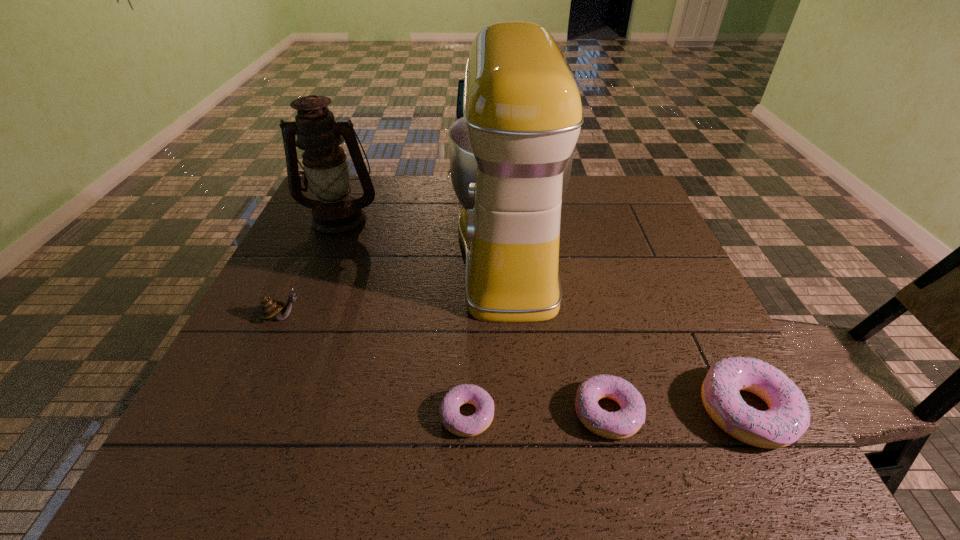
Where is `the leftmost doughnut`? This screenshot has width=960, height=540. the leftmost doughnut is located at coordinates (465, 426).

At what (x,y) coordinates should I click in order to perform the action: click on the shortest object. Please return your answer as a coordinate pair (x, y). Looking at the image, I should click on (465, 426).

Image resolution: width=960 pixels, height=540 pixels. Identify the location of the second shortest doughnut. (625, 422).

At what (x,y) coordinates should I click in order to perform the action: click on the second shortest object. Please return your answer as a coordinate pair (x, y). This screenshot has width=960, height=540. Looking at the image, I should click on (625, 422).

Where is `the fourth tallest object`? The height and width of the screenshot is (540, 960). the fourth tallest object is located at coordinates (788, 417).

In order to click on the rightmost object in this screenshot , I will do `click(788, 417)`.

I want to click on mixer, so click(x=511, y=154).

I want to click on lantern, so click(x=335, y=214).

In order to click on the third tallest object in this screenshot , I will do `click(270, 309)`.

You are a GUI agent. You are given a task and a screenshot of the screen. Output one action in this format:
    pyautogui.click(x=<x>, y=<y>)
    Task: Click on the vacant area situated 0.160m on the back of the shortest doughnut
    Image resolution: width=960 pixels, height=540 pixels.
    Given the screenshot: What is the action you would take?
    pyautogui.click(x=469, y=330)